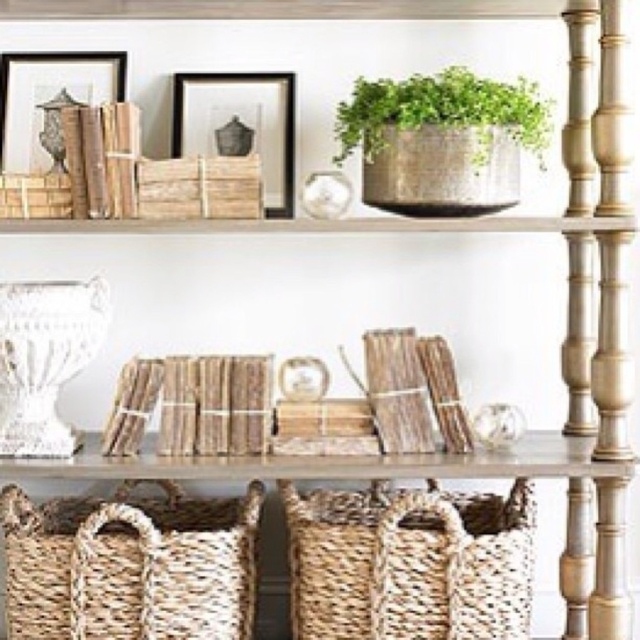
You are organizing a shelf and see the green woven basket at upper center and the rustic wicker basket at upper left. Which basket is positioned higher on the shelf?

The green woven basket at upper center is positioned higher than the rustic wicker basket at upper left because it is located above it.

You are standing in front of the shelving unit and want to reach two specific points on the shelves. Which point, point (500,596) or point (388,144), is closer to you?

Point (500,596) is closer to the camera than point (388,144), so it is closer to you.